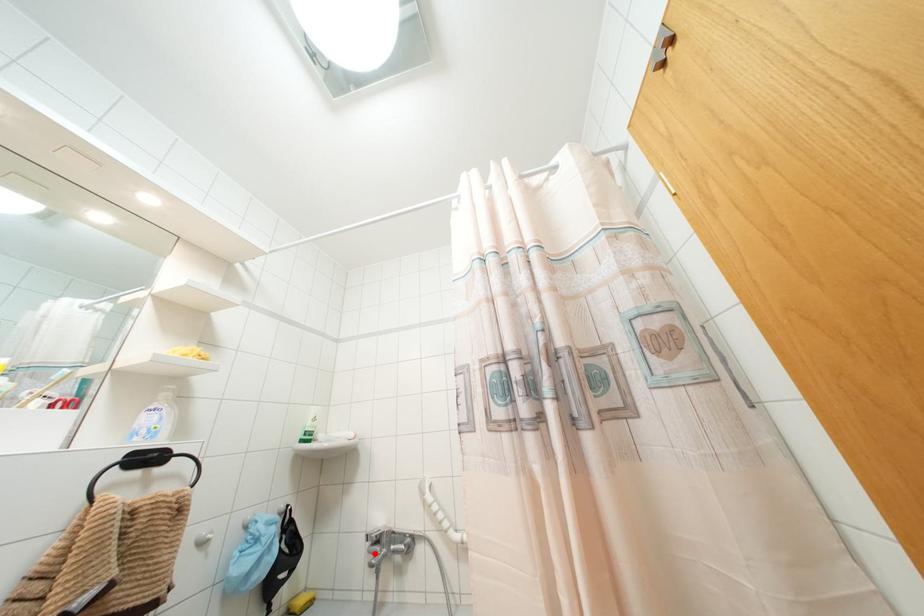
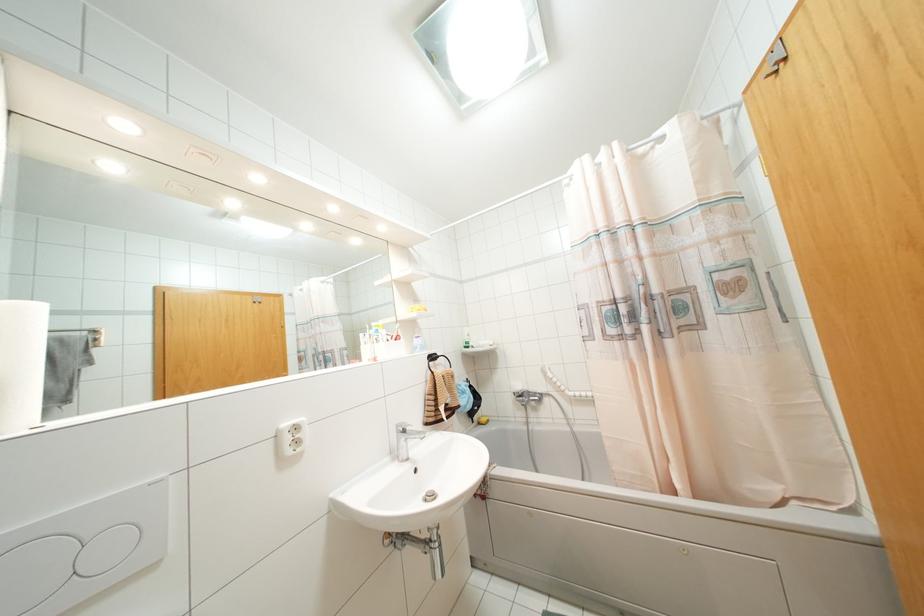
Find the pixel in the second image that matches the highlighted location in the first image.

(523, 400)